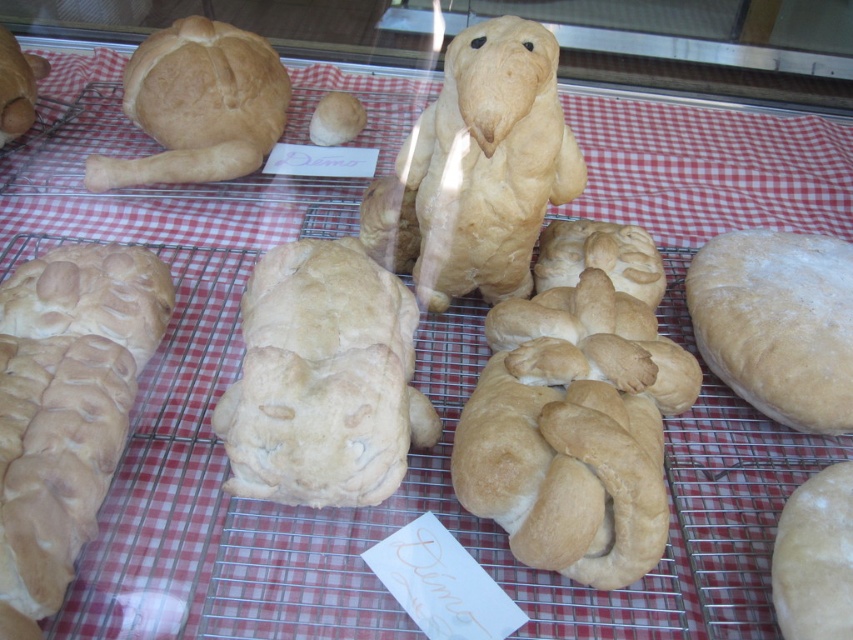
Question: Observing the image, what is the correct spatial positioning of golden brown crusty loaf at lower left in reference to golden brown crusty loaf at right?

Choices:
 (A) above
 (B) below

Answer: (B)

Question: Among these objects, which one is farthest from the camera?

Choices:
 (A) golden brown crusty loaf at lower left
 (B) smooth white loaf at lower right
 (C) golden brown doughnut at center
 (D) golden brown crusty loaf at right

Answer: (D)

Question: Can you confirm if golden brown crusty loaf at upper left is bigger than smooth white loaf at lower right?

Choices:
 (A) no
 (B) yes

Answer: (B)

Question: Which point is closer to the camera?

Choices:
 (A) golden brown crusty loaf at upper left
 (B) golden brown crusty loaf at lower left
 (C) golden brown crusty loaf at right
 (D) smooth white loaf at lower right

Answer: (B)

Question: Among these objects, which one is farthest from the camera?

Choices:
 (A) golden brown crusty loaf at lower left
 (B) golden brown crusty loaf at right

Answer: (B)

Question: Can you confirm if golden brown crusty loaf at lower left is smaller than golden brown crusty loaf at right?

Choices:
 (A) no
 (B) yes

Answer: (A)